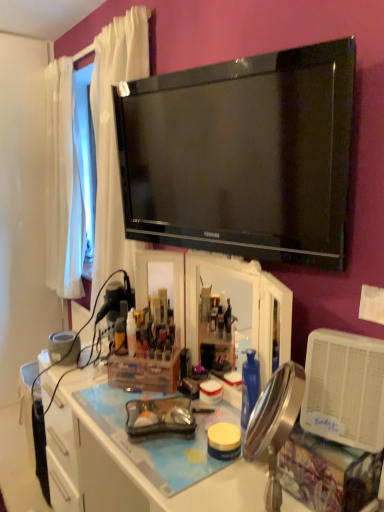
Question: Which direction should I rotate to look at translucent plastic bottle at center, the first bottle when ordered from left to right, — up or down?

Choices:
 (A) up
 (B) down

Answer: (B)

Question: Is black glossy tv at upper center far away from translucent plastic bottle at center, which is the 2th bottle in right-to-left order?

Choices:
 (A) no
 (B) yes

Answer: (A)

Question: From a real-world perspective, is black glossy tv at upper center located beneath translucent plastic bottle at center, which is the 2th bottle in right-to-left order?

Choices:
 (A) no
 (B) yes

Answer: (A)

Question: Considering the relative sizes of black glossy tv at upper center and translucent plastic bottle at center, which is the 2th bottle in right-to-left order, in the image provided, is black glossy tv at upper center taller than translucent plastic bottle at center, which is the 2th bottle in right-to-left order,?

Choices:
 (A) yes
 (B) no

Answer: (A)

Question: Is translucent plastic bottle at center, which is the 2th bottle in right-to-left order, located within black glossy tv at upper center?

Choices:
 (A) yes
 (B) no

Answer: (B)

Question: Is black glossy tv at upper center at the right side of translucent plastic bottle at center, the first bottle when ordered from left to right?

Choices:
 (A) no
 (B) yes

Answer: (B)

Question: Is black glossy tv at upper center shorter than translucent plastic bottle at center, the first bottle when ordered from left to right?

Choices:
 (A) yes
 (B) no

Answer: (B)

Question: From the image's perspective, is metallic gold mirror at center beneath translucent plastic container at center?

Choices:
 (A) no
 (B) yes

Answer: (A)

Question: From a real-world perspective, is metallic gold mirror at center below translucent plastic container at center?

Choices:
 (A) no
 (B) yes

Answer: (A)

Question: Is the depth of metallic gold mirror at center greater than that of translucent plastic container at center?

Choices:
 (A) yes
 (B) no

Answer: (B)

Question: Is metallic gold mirror at center bigger than translucent plastic container at center?

Choices:
 (A) no
 (B) yes

Answer: (B)

Question: Is metallic gold mirror at center to the left of translucent plastic container at center from the viewer's perspective?

Choices:
 (A) no
 (B) yes

Answer: (A)

Question: Is metallic gold mirror at center positioned beyond the bounds of translucent plastic container at center?

Choices:
 (A) yes
 (B) no

Answer: (A)

Question: Considering the relative positions of translucent plastic bottle at center, which is the 2th bottle in right-to-left order, and translucent plastic container at center in the image provided, is translucent plastic bottle at center, which is the 2th bottle in right-to-left order, to the left of translucent plastic container at center from the viewer's perspective?

Choices:
 (A) yes
 (B) no

Answer: (A)